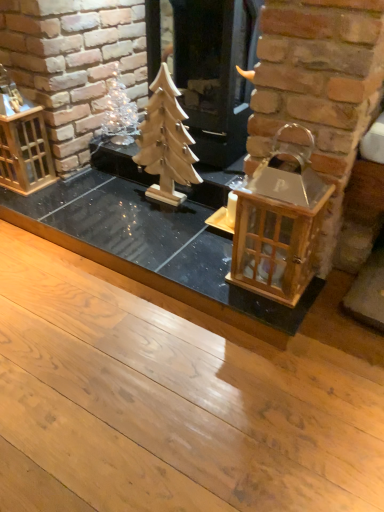
Describe the element at coordinates (277, 241) in the screenshot. I see `wooden lantern at right` at that location.

In order to face wooden christmas tree at center, should I rotate leftwards or rightwards?

Rotate right and turn 2.141 degrees.

In order to face clear glass ornament at upper left, should I rotate leftwards or rightwards?

You should rotate left by 9.996 degrees.

What is the approximate height of wooden christmas tree at center?

It is 59.15 centimeters.

This screenshot has width=384, height=512. Find the location of `wooden lantern at right`. wooden lantern at right is located at coordinates coord(277,241).

How different are the orientations of wooden christmas tree at center and clear glass ornament at upper left in degrees?

0.000303 degrees separate the facing orientations of wooden christmas tree at center and clear glass ornament at upper left.

Between wooden christmas tree at center and clear glass ornament at upper left, which one has larger width?

Wider between the two is wooden christmas tree at center.

Is wooden christmas tree at center completely or partially outside of clear glass ornament at upper left?

That's correct, wooden christmas tree at center is outside of clear glass ornament at upper left.

Would you say wooden lantern at left is part of wooden christmas tree at center's contents?

Actually, wooden lantern at left is outside wooden christmas tree at center.

Is wooden christmas tree at center with wooden lantern at left?

No.

Based on their sizes in the image, would you say wooden christmas tree at center is bigger or smaller than wooden lantern at left?

In the image, wooden christmas tree at center appears to be larger than wooden lantern at left.

What's the angular difference between wooden christmas tree at center and wooden lantern at left's facing directions?

0.000324 degrees.

Can you tell me how much clear glass ornament at upper left and wooden christmas tree at center differ in facing direction?

0.000303 degrees separate the facing orientations of clear glass ornament at upper left and wooden christmas tree at center.

Are clear glass ornament at upper left and wooden christmas tree at center far apart?

No, clear glass ornament at upper left is not far from wooden christmas tree at center.

From a real-world perspective, which is physically above, clear glass ornament at upper left or wooden christmas tree at center?

wooden christmas tree at center.

Can you confirm if clear glass ornament at upper left is wider than wooden christmas tree at center?

No.

In the scene shown: Can you see wooden christmas tree at center touching clear glass ornament at upper left?

No, wooden christmas tree at center is not next to clear glass ornament at upper left.

Could you tell me if wooden christmas tree at center is turned towards clear glass ornament at upper left?

No, wooden christmas tree at center does not turn towards clear glass ornament at upper left.

Who is bigger, wooden christmas tree at center or clear glass ornament at upper left?

wooden christmas tree at center.

From the image's perspective, does wooden christmas tree at center appear higher than clear glass ornament at upper left?

No, from the image's perspective, wooden christmas tree at center is not on top of clear glass ornament at upper left.

Is point (34, 173) closer or farther from the camera than point (158, 116)?

Point (34, 173) is farther from the camera than point (158, 116).

Can you confirm if wooden lantern at left is wider than wooden christmas tree at center?

Yes, wooden lantern at left is wider than wooden christmas tree at center.

Measure the distance between wooden lantern at left and wooden christmas tree at center.

wooden lantern at left is 53.44 centimeters from wooden christmas tree at center.

From a real-world perspective, who is located higher, wooden christmas tree at center or wooden lantern at right?

wooden christmas tree at center is physically above.

Is wooden christmas tree at center directly adjacent to wooden lantern at right?

No, wooden christmas tree at center is not next to wooden lantern at right.

Consider the image. Can you confirm if wooden christmas tree at center is smaller than wooden lantern at right?

Yes.

Which is closer to the camera, (173, 106) or (186, 109)?

The point (173, 106) is in front.

Considering the relative sizes of wooden christmas tree at center and wooden christmas tree at center in the image provided, is wooden christmas tree at center taller than wooden christmas tree at center?

No, wooden christmas tree at center is not taller than wooden christmas tree at center.

From a real-world perspective, which is physically below, wooden christmas tree at center or wooden christmas tree at center?

wooden christmas tree at center is physically lower.

Is wooden christmas tree at center to the left of wooden christmas tree at center from the viewer's perspective?

Indeed, wooden christmas tree at center is positioned on the left side of wooden christmas tree at center.

Where is `christmas decoration located underneath the wooden christmas tree at center (from a real-world perspective)`? The image size is (384, 512). christmas decoration located underneath the wooden christmas tree at center (from a real-world perspective) is located at coordinates (118, 114).

Find the location of a particular element. Image resolution: width=384 pixels, height=512 pixels. fireplace on the right of wooden lantern at left is located at coordinates coord(215,73).

From the picture: Estimate the real-world distances between objects in this image. Which object is closer to wooden lantern at left, clear glass ornament at upper left or wooden christmas tree at center?

Based on the image, clear glass ornament at upper left appears to be nearer to wooden lantern at left.

Estimate the real-world distances between objects in this image. Which object is closer to clear glass ornament at upper left, wooden christmas tree at center or wooden lantern at right?

wooden christmas tree at center lies closer to clear glass ornament at upper left than the other object.

From the image, which object appears to be nearer to wooden lantern at right, wooden christmas tree at center or wooden lantern at left?

The object closer to wooden lantern at right is wooden christmas tree at center.

Based on their spatial positions, is wooden lantern at left or wooden christmas tree at center further from wooden christmas tree at center?

Based on the image, wooden lantern at left appears to be further to wooden christmas tree at center.

Estimate the real-world distances between objects in this image. Which object is further from wooden lantern at right, wooden christmas tree at center or wooden christmas tree at center?

The object further to wooden lantern at right is wooden christmas tree at center.

When comparing their distances from clear glass ornament at upper left, does wooden lantern at right or wooden christmas tree at center seem closer?

Among the two, wooden christmas tree at center is located nearer to clear glass ornament at upper left.

From the picture: Which object lies nearer to the anchor point wooden christmas tree at center, wooden christmas tree at center or clear glass ornament at upper left?

wooden christmas tree at center lies closer to wooden christmas tree at center than the other object.

Considering their positions, is wooden lantern at left positioned further to wooden lantern at right than clear glass ornament at upper left?

clear glass ornament at upper left lies further to wooden lantern at right than the other object.

The width and height of the screenshot is (384, 512). What are the coordinates of `fireplace located between wooden lantern at right and clear glass ornament at upper left in the depth direction` in the screenshot? It's located at (215, 73).

Image resolution: width=384 pixels, height=512 pixels. I want to click on christmas decoration between wooden lantern at left and wooden christmas tree at center in the horizontal direction, so click(x=118, y=114).

This screenshot has width=384, height=512. What are the coordinates of `christmas tree located between wooden lantern at right and clear glass ornament at upper left in the depth direction` in the screenshot? It's located at click(166, 142).

At what (x,y) coordinates should I click in order to perform the action: click on christmas tree between clear glass ornament at upper left and wooden christmas tree at center. Please return your answer as a coordinate pair (x, y). The height and width of the screenshot is (512, 384). Looking at the image, I should click on (166, 142).